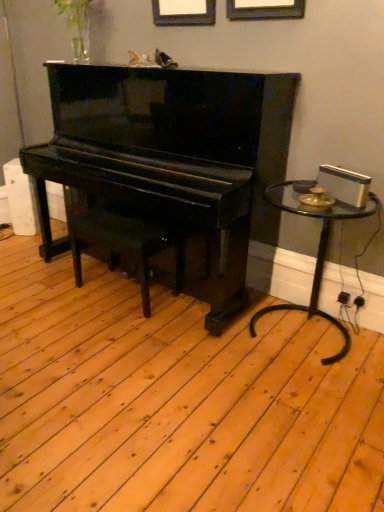
Question: From a real-world perspective, is transparent glass table at right on top of black polished wood music stool at center?

Choices:
 (A) no
 (B) yes

Answer: (B)

Question: Considering the relative positions of transparent glass table at right and black polished wood music stool at center in the image provided, is transparent glass table at right behind black polished wood music stool at center?

Choices:
 (A) no
 (B) yes

Answer: (A)

Question: Is transparent glass table at right thinner than black polished wood music stool at center?

Choices:
 (A) yes
 (B) no

Answer: (B)

Question: Could you tell me if transparent glass table at right is turned towards black polished wood music stool at center?

Choices:
 (A) no
 (B) yes

Answer: (A)

Question: Is transparent glass table at right positioned in front of black polished wood music stool at center?

Choices:
 (A) no
 (B) yes

Answer: (B)

Question: Does transparent glass table at right touch black polished wood music stool at center?

Choices:
 (A) yes
 (B) no

Answer: (B)

Question: Considering the relative sizes of black polished wood music stool at center and glossy black piano at center in the image provided, is black polished wood music stool at center shorter than glossy black piano at center?

Choices:
 (A) no
 (B) yes

Answer: (B)

Question: Considering the relative sizes of black polished wood music stool at center and glossy black piano at center in the image provided, is black polished wood music stool at center wider than glossy black piano at center?

Choices:
 (A) no
 (B) yes

Answer: (A)

Question: Can we say black polished wood music stool at center lies outside glossy black piano at center?

Choices:
 (A) no
 (B) yes

Answer: (A)

Question: From a real-world perspective, is black polished wood music stool at center under glossy black piano at center?

Choices:
 (A) yes
 (B) no

Answer: (A)

Question: Does black polished wood music stool at center have a greater height compared to glossy black piano at center?

Choices:
 (A) no
 (B) yes

Answer: (A)

Question: Is black polished wood music stool at center oriented towards glossy black piano at center?

Choices:
 (A) yes
 (B) no

Answer: (A)

Question: From the image's perspective, would you say black polished wood music stool at center is shown under transparent glass table at right?

Choices:
 (A) no
 (B) yes

Answer: (A)